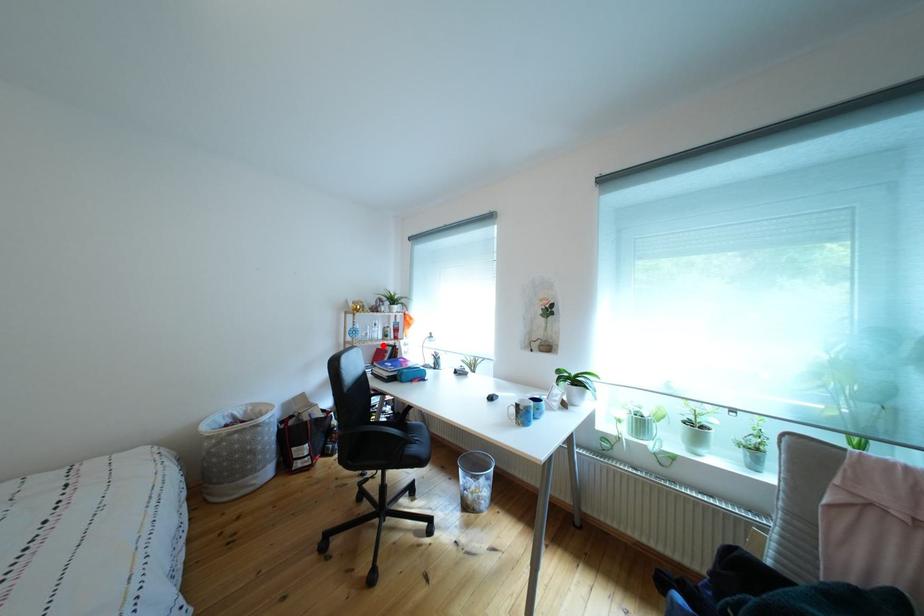
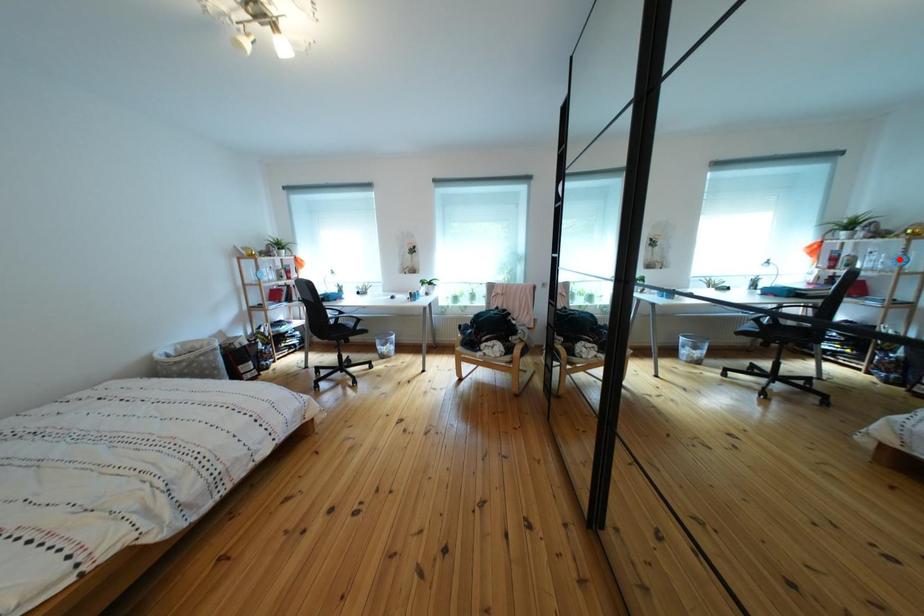
I am providing you with two images of the same scene from different viewpoints. A red point is marked on the first image and another point is marked on the second image. Are the points marked in image1 and image2 representing the same 3D position?

No